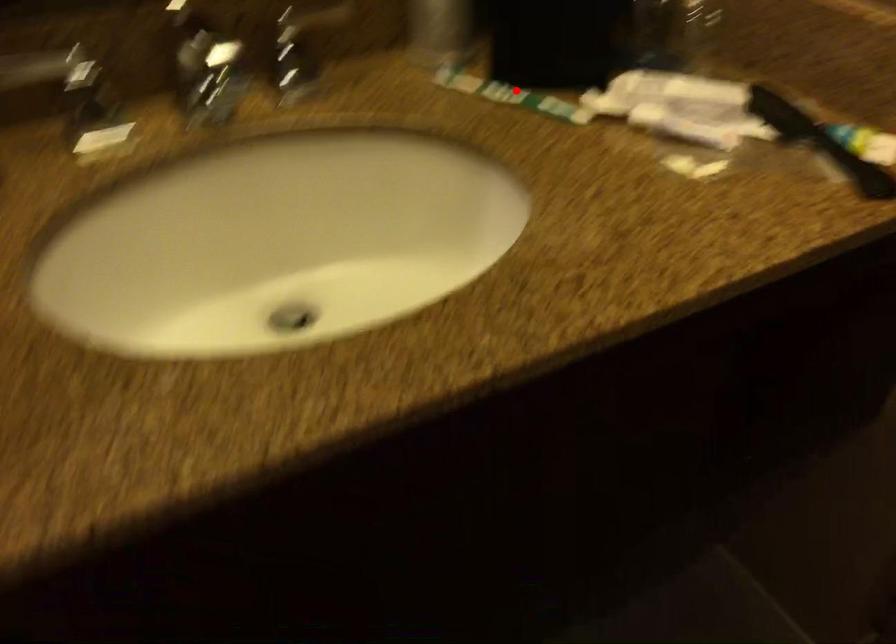
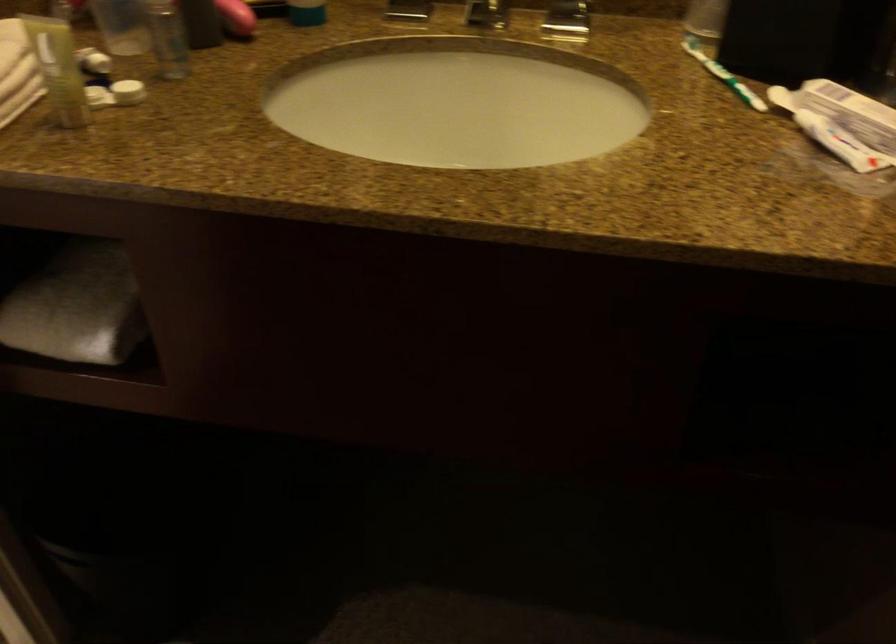
Find the pixel in the second image that matches the highlighted location in the first image.

(722, 75)